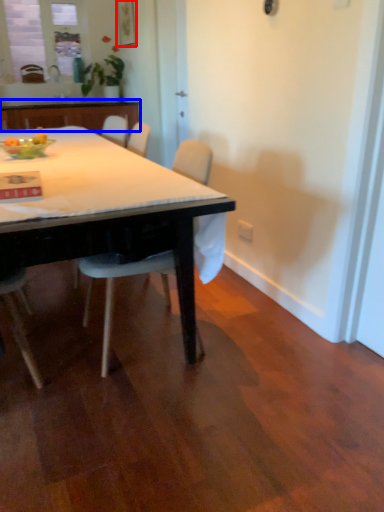
Question: Which of the following is the farthest to the observer, picture frame (highlighted by a red box) or cabinetry (highlighted by a blue box)?

Choices:
 (A) picture frame
 (B) cabinetry

Answer: (A)